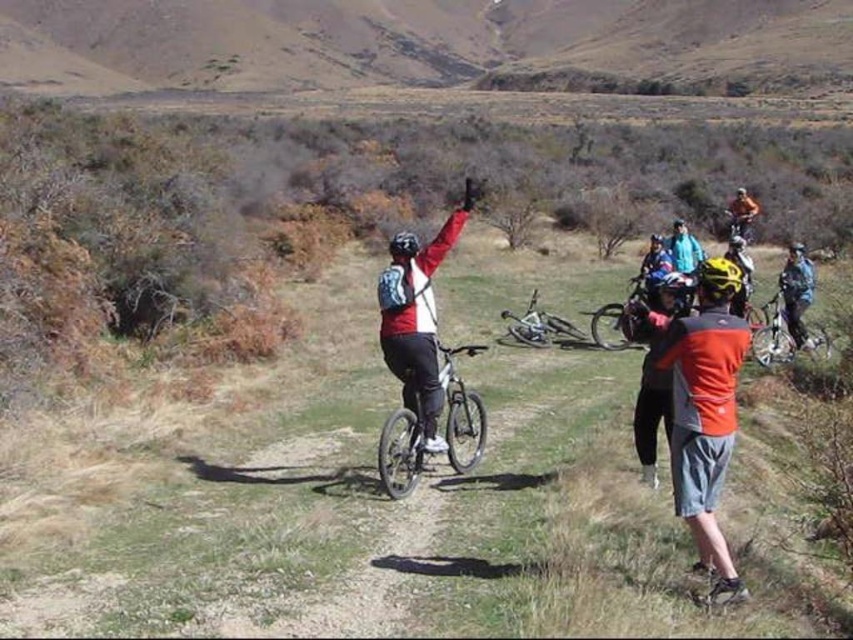
You are a photographer trying to capture the two subjects in the scene. The orange fabric shirt at center and the shiny black helmet at center are both in focus. Which object is narrower in width?

The orange fabric shirt at center is narrower in width than the shiny black helmet at center.

You are a photographer trying to capture a clear shot of the orange fabric shirt at center and the shiny black helmet at center. Since you want to focus on the shirt, which object should you adjust your camera to prioritize in terms of focus distance?

The orange fabric shirt at center has a greater height compared to the shiny black helmet at center, so you should adjust your camera to prioritize focusing on the orange fabric shirt at center to ensure it is in clear focus.

You are a photographer trying to capture a shot of the silver metallic bicycle at center and the matte black helmet at center. Based on their positions, which object is closer to the camera?

The silver metallic bicycle at center is positioned under the matte black helmet at center, so the helmet is closer to the camera.